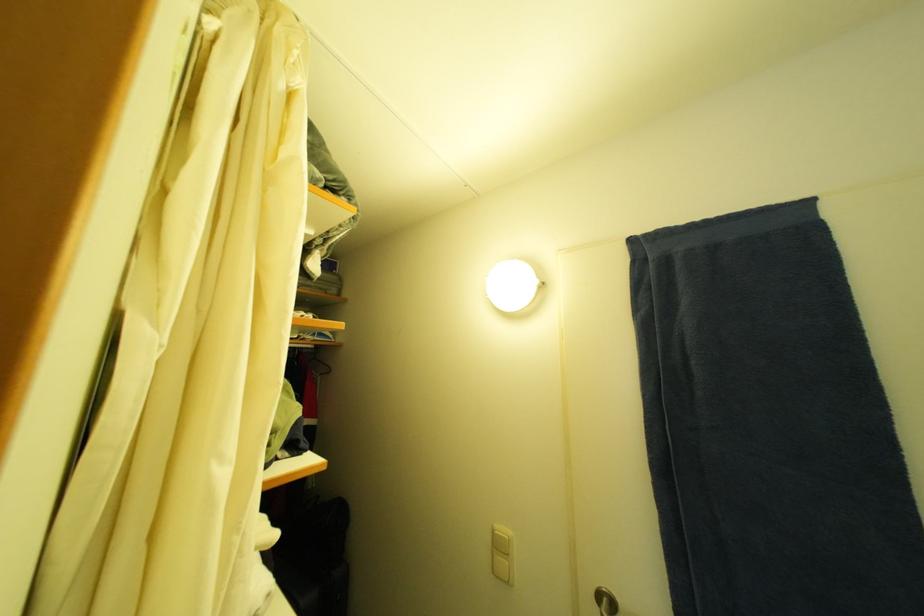
Locate an element on the screen. This screenshot has height=616, width=924. silver door handle is located at coordinates (604, 601).